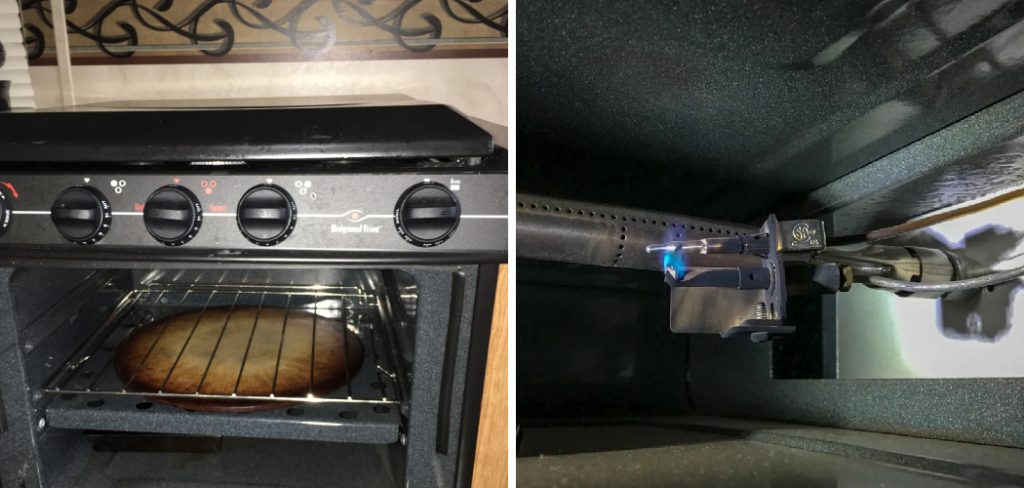
Identify the location of stove. The image size is (1024, 488). (206, 175).